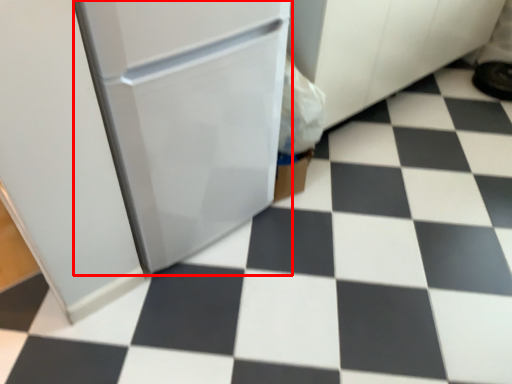
Question: Where is appliance (annotated by the red box) located in relation to footwear in the image?

Choices:
 (A) right
 (B) left

Answer: (B)